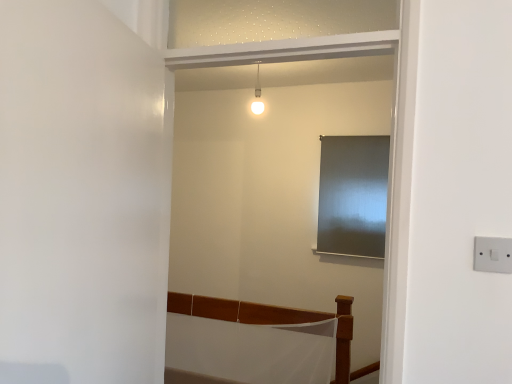
Question: In the image, is satin silver curtain at center on the left side or the right side of white plastic switch at right?

Choices:
 (A) left
 (B) right

Answer: (B)

Question: Considering the positions of satin silver curtain at center and white plastic switch at right in the image, is satin silver curtain at center bigger or smaller than white plastic switch at right?

Choices:
 (A) big
 (B) small

Answer: (A)

Question: Estimate the real-world distances between objects in this image. Which object is farther from the white matte door at left?

Choices:
 (A) wooden bed frame at lower center
 (B) white plastic switch at right
 (C) white glossy light fixture at upper center
 (D) satin silver curtain at center

Answer: (D)

Question: Which object is the farthest from the white glossy light fixture at upper center?

Choices:
 (A) wooden bed frame at lower center
 (B) satin silver curtain at center
 (C) white plastic switch at right
 (D) white matte door at left

Answer: (C)